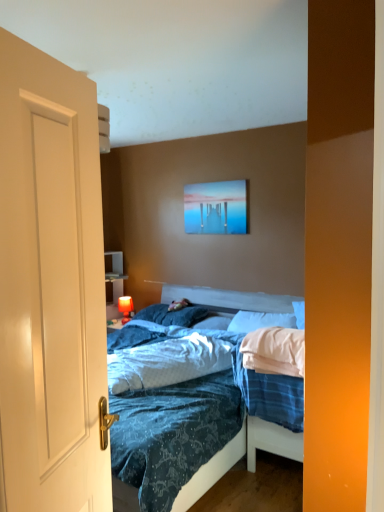
Question: Is matte orange lamp at left facing away from pillow at center, arranged as the first pillow when viewed from the right?

Choices:
 (A) no
 (B) yes

Answer: (A)

Question: Could you tell me if matte orange lamp at left is facing pillow at center, marked as the third pillow in a left-to-right arrangement?

Choices:
 (A) yes
 (B) no

Answer: (B)

Question: Can you confirm if matte orange lamp at left is positioned to the right of pillow at center, arranged as the first pillow when viewed from the right?

Choices:
 (A) no
 (B) yes

Answer: (A)

Question: From the image's perspective, is matte orange lamp at left located above pillow at center, arranged as the first pillow when viewed from the right?

Choices:
 (A) yes
 (B) no

Answer: (B)

Question: Is matte orange lamp at left outside pillow at center, marked as the third pillow in a left-to-right arrangement?

Choices:
 (A) no
 (B) yes

Answer: (B)

Question: Can you confirm if matte orange lamp at left is smaller than pillow at center, arranged as the first pillow when viewed from the right?

Choices:
 (A) yes
 (B) no

Answer: (A)

Question: Is pillow at center, arranged as the first pillow when viewed from the right, shorter than matte orange lamp at left?

Choices:
 (A) yes
 (B) no

Answer: (A)

Question: From a real-world perspective, is pillow at center, arranged as the first pillow when viewed from the right, physically above matte orange lamp at left?

Choices:
 (A) yes
 (B) no

Answer: (A)

Question: From the image's perspective, is pillow at center, arranged as the first pillow when viewed from the right, beneath matte orange lamp at left?

Choices:
 (A) yes
 (B) no

Answer: (B)

Question: Is pillow at center, arranged as the first pillow when viewed from the right, to the left of matte orange lamp at left from the viewer's perspective?

Choices:
 (A) yes
 (B) no

Answer: (B)

Question: Does pillow at center, marked as the third pillow in a left-to-right arrangement, have a larger size compared to matte orange lamp at left?

Choices:
 (A) yes
 (B) no

Answer: (A)

Question: Is pillow at center, arranged as the first pillow when viewed from the right, positioned in front of matte orange lamp at left?

Choices:
 (A) yes
 (B) no

Answer: (A)

Question: Considering the relative sizes of blue textured fabric at center and pillow at center, arranged as the first pillow when viewed from the right, in the image provided, is blue textured fabric at center bigger than pillow at center, arranged as the first pillow when viewed from the right,?

Choices:
 (A) yes
 (B) no

Answer: (A)